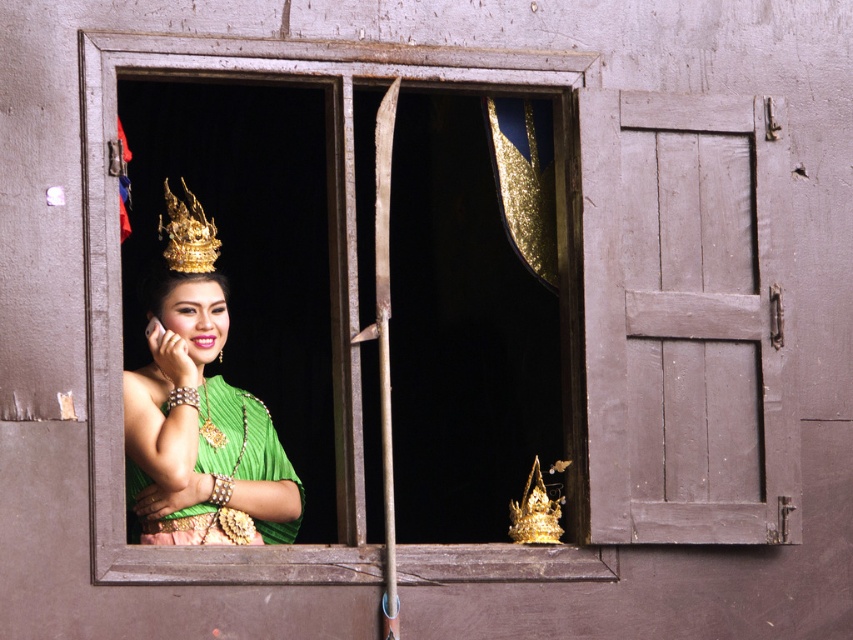
Question: Which point is farther to the camera?

Choices:
 (A) gold metallic crown at upper left
 (B) green pleated fabric dress at center

Answer: (A)

Question: Can you confirm if gold metallic crown at upper left is positioned to the right of green fabric headdress at center?

Choices:
 (A) no
 (B) yes

Answer: (B)

Question: Which object is closer to the camera taking this photo?

Choices:
 (A) green pleated fabric dress at center
 (B) green silk dress at center
 (C) gold metallic crown at upper center

Answer: (C)

Question: Which is nearer to the green pleated fabric dress at center?

Choices:
 (A) green fabric headdress at center
 (B) gold metallic crown at upper left
 (C) wooden window frame at center
 (D) gold metallic crown at upper center

Answer: (A)

Question: Does wooden shutter at right lie behind green fabric headdress at center?

Choices:
 (A) no
 (B) yes

Answer: (A)

Question: Is gold metallic crown at upper center below green fabric headdress at center?

Choices:
 (A) yes
 (B) no

Answer: (A)